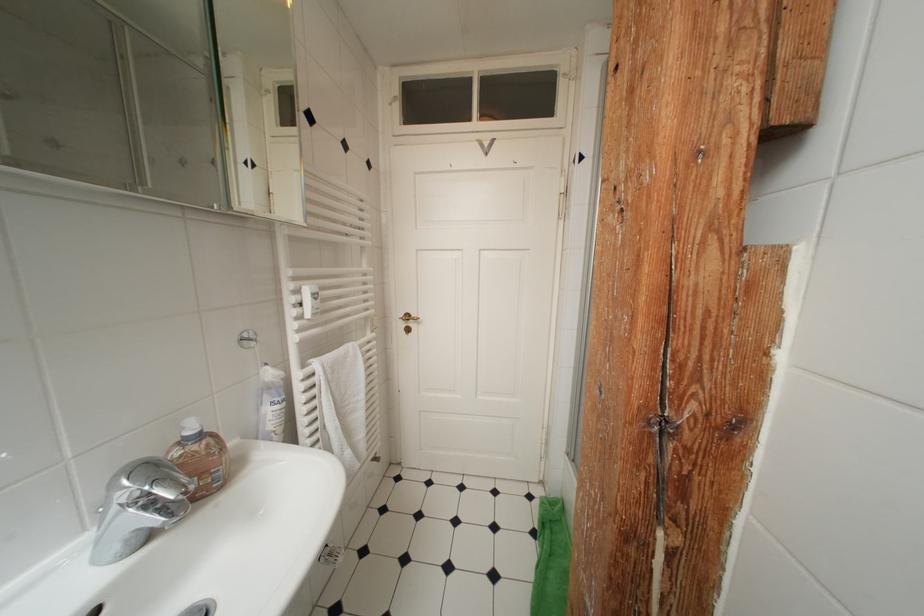
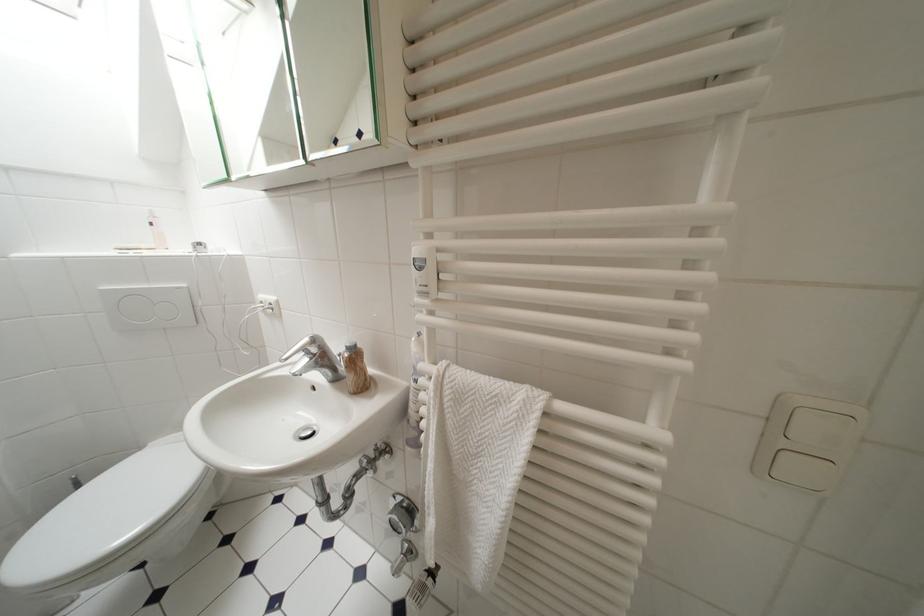
In the second image, find the point that corresponds to point (330, 382) in the first image.

(439, 397)